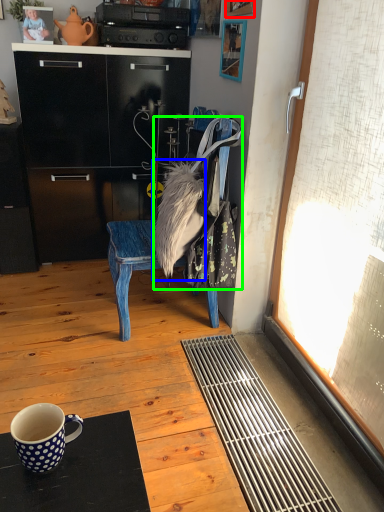
Question: Which object is the farthest from picture frame (highlighted by a red box)? Choose among these: fur (highlighted by a blue box) or handbag (highlighted by a green box).

Choices:
 (A) fur
 (B) handbag

Answer: (A)